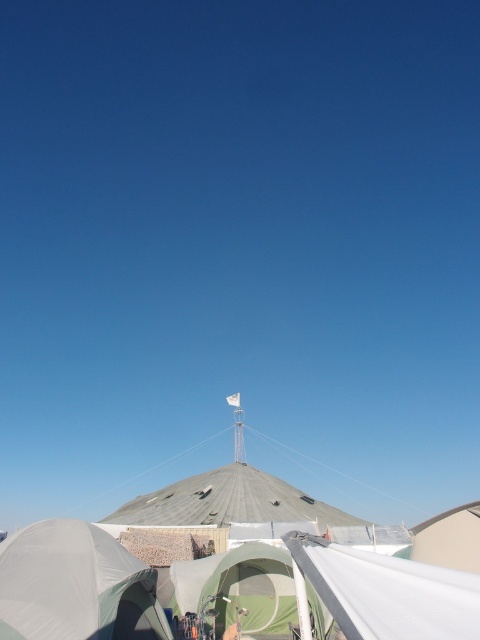
Question: Which point is farther to the camera?

Choices:
 (A) green fabric tent at center
 (B) white fabric tent at center
 (C) white fabric tent at lower left

Answer: (A)

Question: Estimate the real-world distances between objects in this image. Which object is farther from the white fabric tent at center?

Choices:
 (A) green fabric tent at center
 (B) white matte canopy at lower right
 (C) white fabric tent at lower left

Answer: (B)

Question: Is white matte canopy at lower right bigger than green fabric tent at center?

Choices:
 (A) yes
 (B) no

Answer: (B)

Question: Is white fabric tent at center behind white fabric tent at lower left?

Choices:
 (A) yes
 (B) no

Answer: (B)

Question: Observing the image, what is the correct spatial positioning of white fabric tent at lower left in reference to white matte canopy at lower right?

Choices:
 (A) above
 (B) below

Answer: (B)

Question: Which point is farther to the camera?

Choices:
 (A) white fabric tent at lower left
 (B) white matte canopy at lower right
 (C) white fabric tent at center
 (D) green fabric tent at center

Answer: (D)